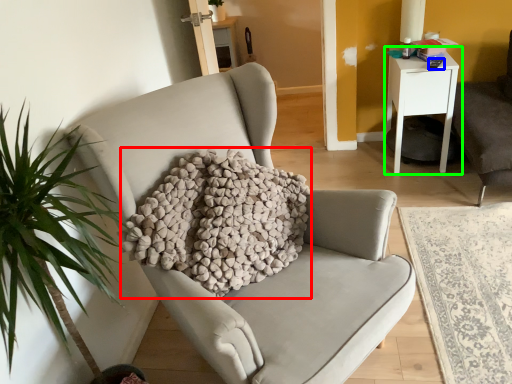
Question: Which is farther away from pillow (highlighted by a red box)? remote control (highlighted by a blue box) or nightstand (highlighted by a green box)?

Choices:
 (A) remote control
 (B) nightstand

Answer: (A)